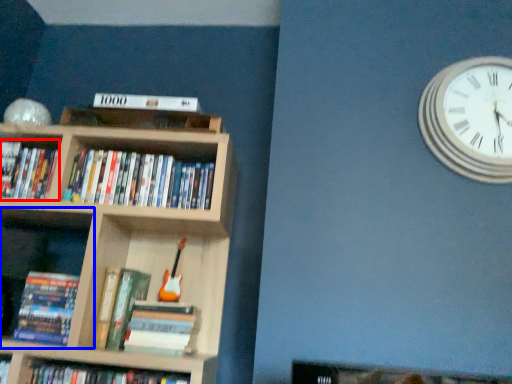
Question: Which object is further to the camera taking this photo, book (highlighted by a red box) or shelf (highlighted by a blue box)?

Choices:
 (A) book
 (B) shelf

Answer: (A)